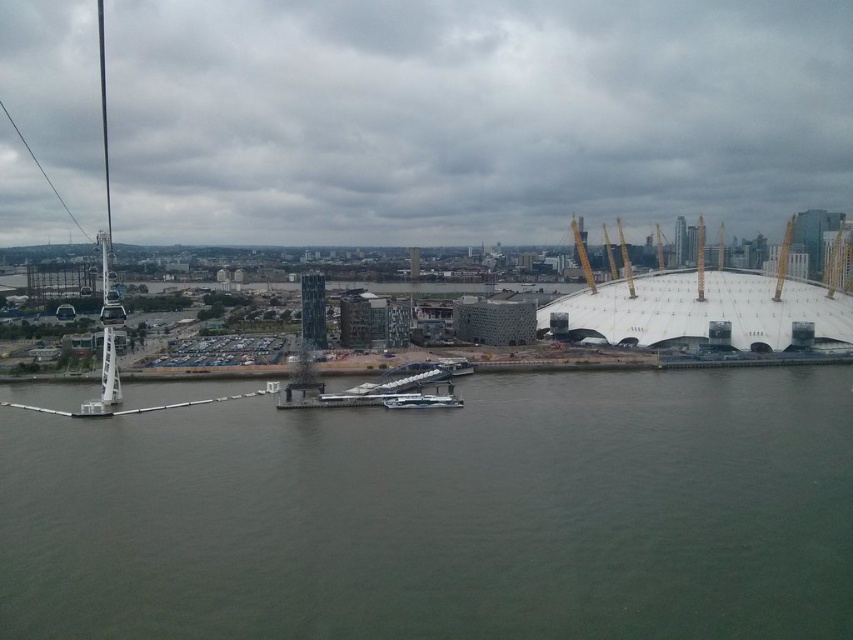
Question: Which object is closer to the camera taking this photo?

Choices:
 (A) greenish-gray water at center
 (B) white glossy boat at center
 (C) metallic silver boat at center

Answer: (A)

Question: Which point is farther from the camera taking this photo?

Choices:
 (A) (451, 356)
 (B) (107, 433)

Answer: (A)

Question: Can you confirm if metallic silver boat at center is bigger than white glossy boat at center?

Choices:
 (A) no
 (B) yes

Answer: (A)

Question: Does greenish-gray water at center have a greater width compared to white glossy boat at center?

Choices:
 (A) no
 (B) yes

Answer: (B)

Question: Which point is closer to the camera?

Choices:
 (A) white glossy boat at center
 (B) greenish-gray water at center
 (C) metallic silver boat at center

Answer: (B)

Question: Does greenish-gray water at center come in front of white glossy boat at center?

Choices:
 (A) yes
 (B) no

Answer: (A)